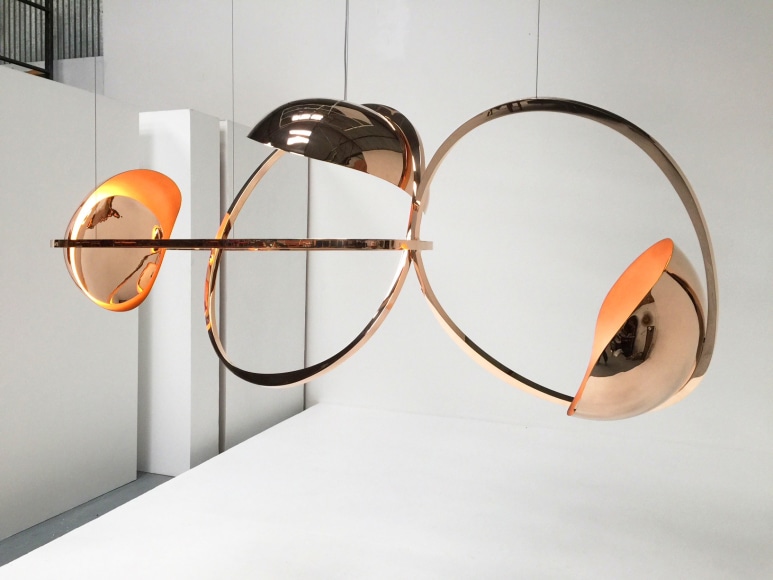
Where is `reflective surface`? The height and width of the screenshot is (580, 773). reflective surface is located at coordinates (117, 213), (346, 126), (668, 320), (518, 104), (195, 241), (209, 318).